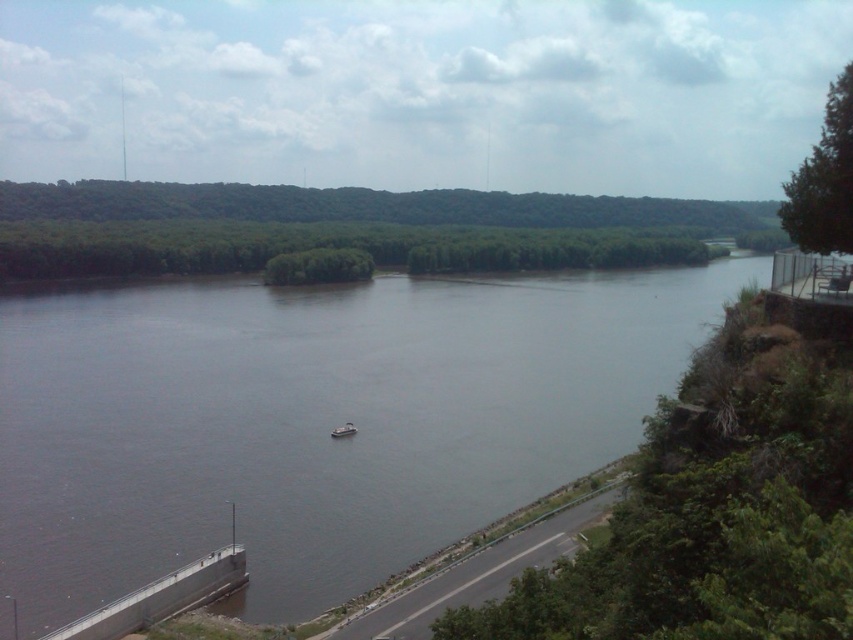
Question: Which of the following is the closest to the observer?

Choices:
 (A) brown water at center
 (B) white plastic boat at center

Answer: (A)

Question: Does brown water at center have a larger size compared to white plastic boat at center?

Choices:
 (A) no
 (B) yes

Answer: (B)

Question: Which point is farther to the camera?

Choices:
 (A) (347, 422)
 (B) (51, 504)

Answer: (A)

Question: Does brown water at center appear over white plastic boat at center?

Choices:
 (A) yes
 (B) no

Answer: (A)

Question: Which object is farther from the camera taking this photo?

Choices:
 (A) white plastic boat at center
 (B) brown water at center

Answer: (A)

Question: Does brown water at center have a smaller size compared to white plastic boat at center?

Choices:
 (A) yes
 (B) no

Answer: (B)